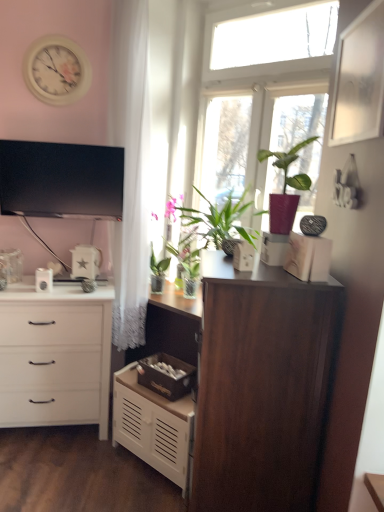
Identify the location of free space between white matte chest of drawers at lower center, positioned as the 2th chest of drawers in left-to-right order, and white matte chest of drawers at left, which appears as the 2th chest of drawers when viewed from the right. This screenshot has width=384, height=512. (87, 460).